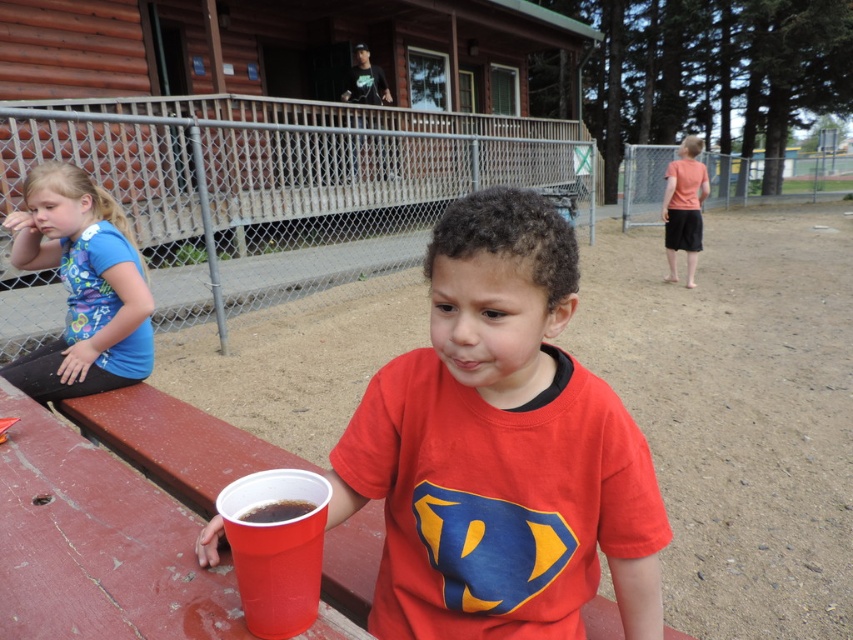
You are a parent at the picnic table and want to hand your child the shiny plastic cup at lower left. The child is wearing the matte pink shirt at right. Can you reach the cup without moving your position?

The shiny plastic cup at lower left has a lesser height compared to matte pink shirt at right, so the cup is lower than the child. You can reach the cup without needing to adjust your position since it is at a lower level than the child.

You are at a picnic table and need to pour a drink into the taller cup. Which cup should you choose between the matte plastic cup at center and the shiny plastic cup at lower left?

The matte plastic cup at center is taller than the shiny plastic cup at lower left, so you should choose the matte plastic cup at center to pour the drink into.

You are standing at the picnic table and want to place your shiny plastic cup somewhere on the table. The cup is represented by the point at coordinates (276, 548). Where should you place it to ensure it doesn not fall off the table?

The shiny plastic cup at lower left is represented by point (276, 548), so you should place it near the center of the table to avoid the edges where it might fall off.